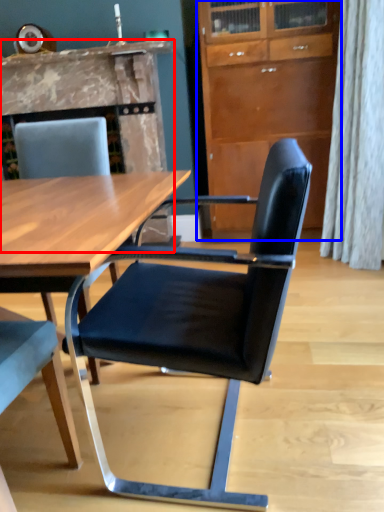
Question: Among these objects, which one is farthest to the camera, fireplace (highlighted by a red box) or cabinetry (highlighted by a blue box)?

Choices:
 (A) fireplace
 (B) cabinetry

Answer: (A)